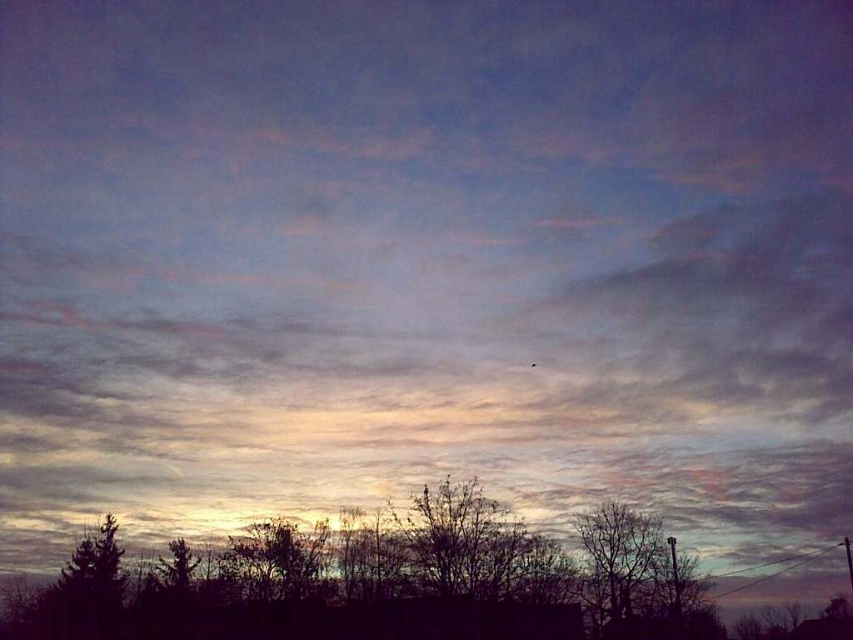
You are a bird looking for a place to perch. You can see the silhouette leafless tree at lower center and the dark brown bark tree at lower right. Which tree is closer to you based on their positions in the scene?

The silhouette leafless tree at lower center is closer to you than the dark brown bark tree at lower right because objects lower in the image are typically closer to the viewer.

You are an astronomer observing the twilight sky. You notice a silhouette leafless tree at lower center. Based on its position, can you determine if it is closer to the horizon or the top of the sky?

The silhouette leafless tree at lower center is positioned at point 0.916 on the x axis and 0.419 on the y axis. Since the y coordinate is closer to 0.5 than 0, it is closer to the horizon than the top of the sky.